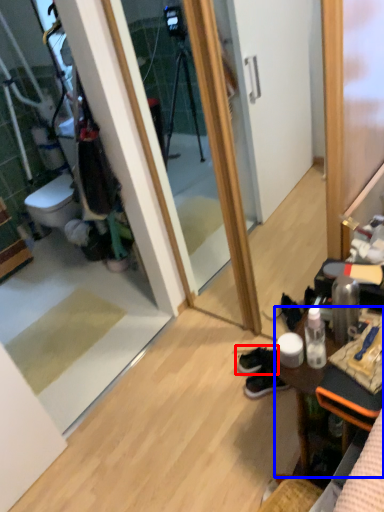
Question: Which point is further to the camera, footwear (highlighted by a red box) or desk (highlighted by a blue box)?

Choices:
 (A) footwear
 (B) desk

Answer: (A)